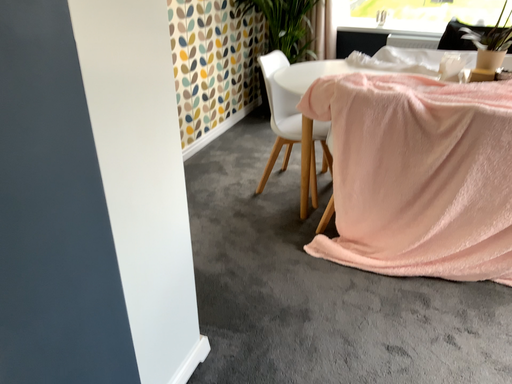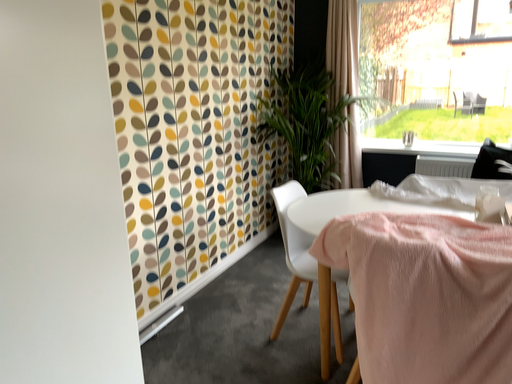
Question: Which way did the camera rotate in the video?

Choices:
 (A) rotated downward
 (B) rotated upward

Answer: (B)